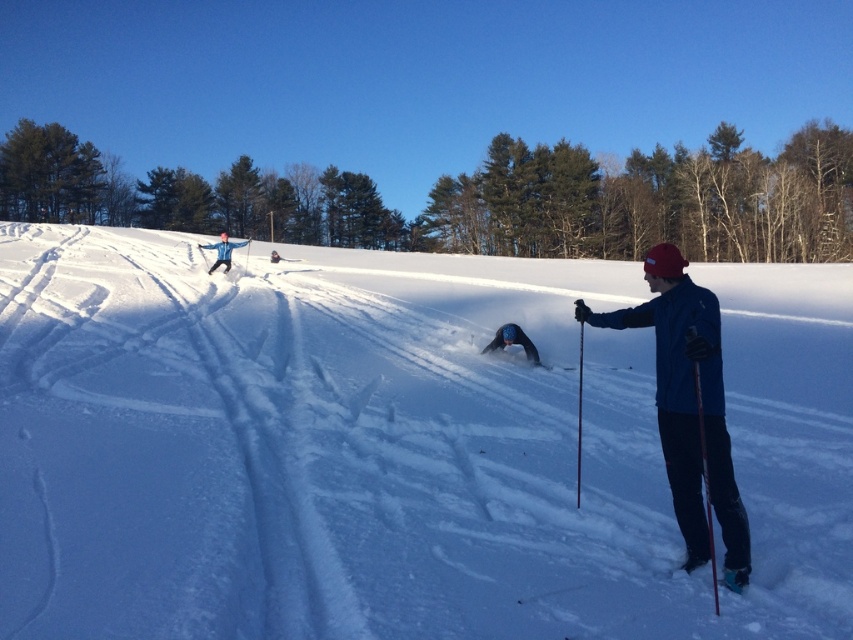
You are a photographer planning to take a photo of the white fluffy snow at center. The camera is set to focus on the point at coordinates point (387, 452). Will the person dressed in dark clothing and a red hat in the foreground be in focus?

The point (387, 452) indicates the white fluffy snow at center, so the camera will focus on the white fluffy snow at center. The person dressed in dark clothing and a red hat in the foreground is not at the focus point, so they may not be in focus.

From the picture: You are a photographer trying to capture a photo of both the red plastic ski pole at right and the white snowboarder at upper left in the same frame. Based on their positions, which object should you adjust your camera to focus on first to ensure both are in the shot?

The red plastic ski pole at right is to the right of the white snowboarder at upper left, so you should focus on the white snowboarder at upper left first to ensure both are in the frame.

You are standing in the snowy scene and want to walk from point (703, 314) to point (717, 588). Which direction should you face to walk towards the second point?

You should face away from the viewer because point (717, 588) is further away than point (703, 314).